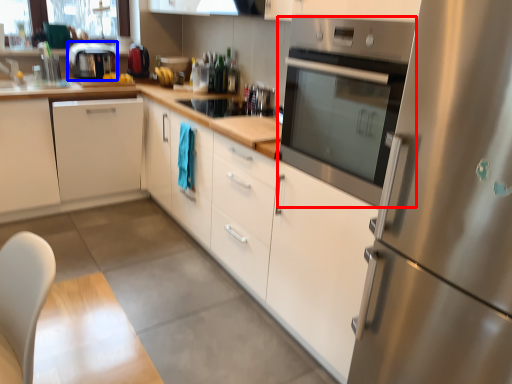
Question: Which object appears farthest to the camera in this image, home appliance (highlighted by a red box) or kitchen appliance (highlighted by a blue box)?

Choices:
 (A) home appliance
 (B) kitchen appliance

Answer: (B)